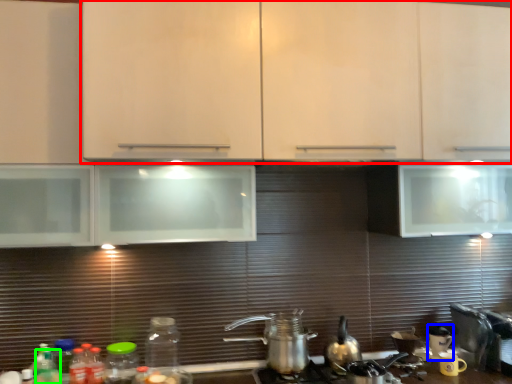
Question: Which object is positioned closest to cabinetry (highlighted by a red box)? Select from appliance (highlighted by a blue box) and bottle (highlighted by a green box).

Choices:
 (A) appliance
 (B) bottle

Answer: (A)